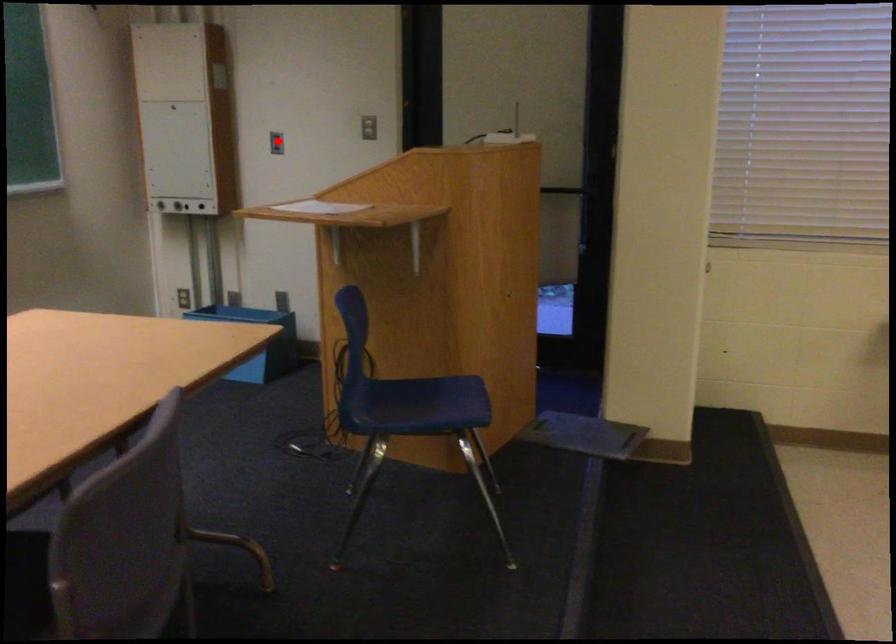
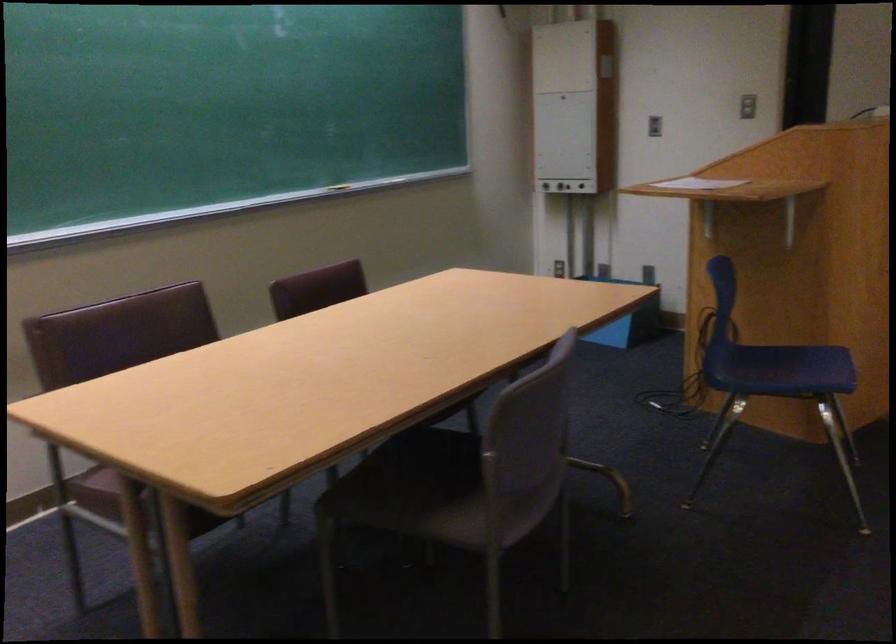
Locate, in the second image, the point that corresponds to the highlighted location in the first image.

(653, 126)